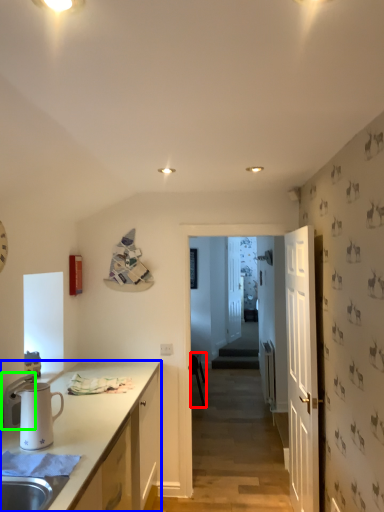
Question: Which object is positioned farthest from chair (highlighted by a red box)? Select from cabinetry (highlighted by a blue box) and appliance (highlighted by a green box).

Choices:
 (A) cabinetry
 (B) appliance

Answer: (B)